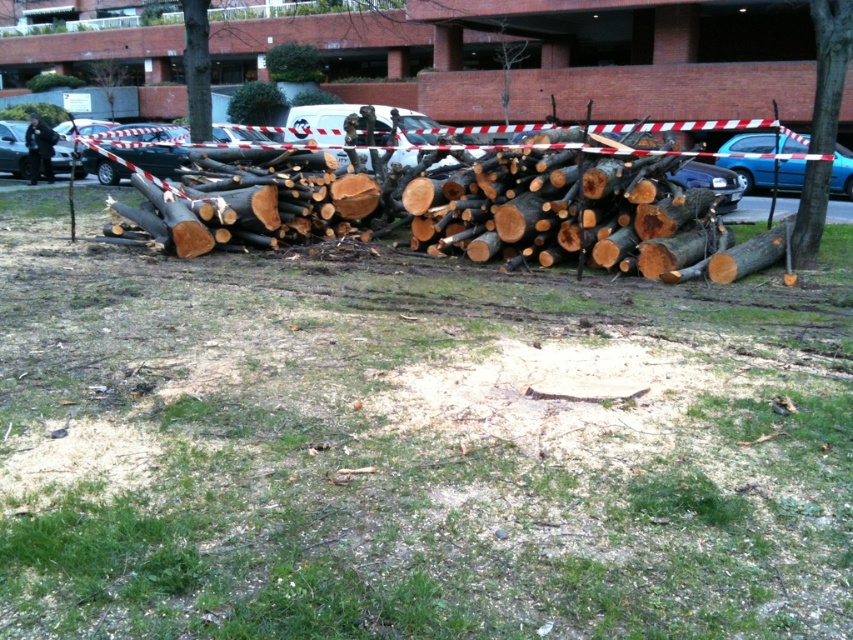
Question: Which of these objects is positioned closest to the green grass at center?

Choices:
 (A) smooth bark tree at right
 (B) metallic silver car at left

Answer: (A)

Question: Among these points, which one is nearest to the camera?

Choices:
 (A) (9, 141)
 (B) (498, 61)

Answer: (A)

Question: Where is blue glossy car at right located in relation to bare wood tree at center in the image?

Choices:
 (A) above
 (B) below

Answer: (B)

Question: Among these objects, which one is farthest from the camera?

Choices:
 (A) white plastic car at center
 (B) blue glossy car at right
 (C) smooth bark tree at right
 (D) bare wood tree at center

Answer: (D)

Question: Does blue glossy car at right have a greater width compared to bare wood tree at center?

Choices:
 (A) yes
 (B) no

Answer: (A)

Question: Does green grass at center have a larger size compared to bare wood tree at center?

Choices:
 (A) no
 (B) yes

Answer: (B)